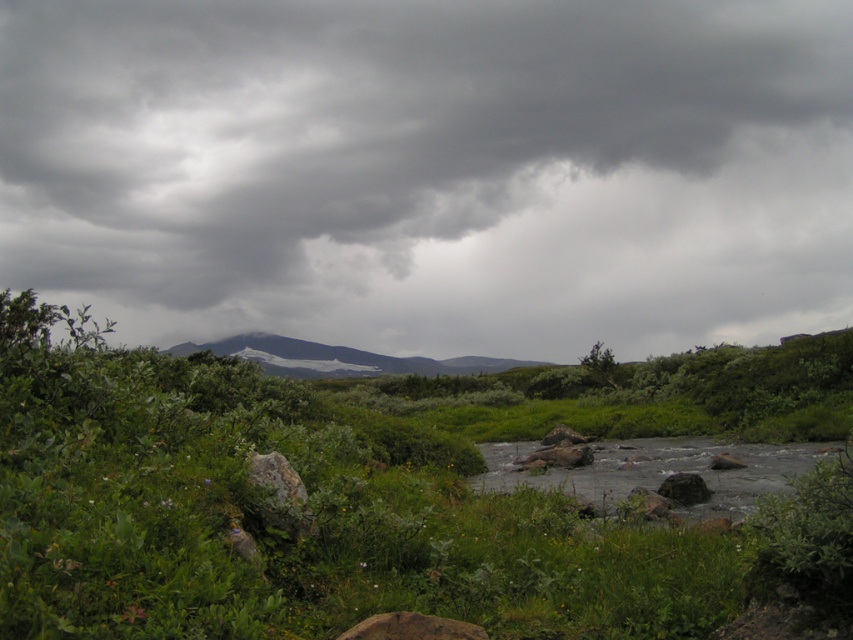
Based on the scene description, what object is located at the coordinates point (422, 150)?

The point (422, 150) indicates a dark gray cloud at upper center.

You are planning to take a photo of the gray rock at lower right and the dark gray cloud at upper center. Which object will appear larger in the photo?

The dark gray cloud at upper center will appear larger in the photo because it is much taller than the gray rock at lower right.

You are standing in the serene landscape and notice the dark gray cloud at upper center. Based on its position, can you determine if it is closer to the foreground or the background?

The dark gray cloud at upper center is located at point coordinates suggesting it is closer to the foreground than the background.